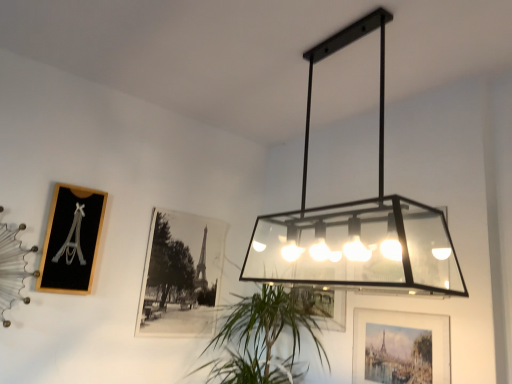
Where is `black wood picture frame at left, which appears as the 3th picture frame when viewed from the right`? This screenshot has width=512, height=384. black wood picture frame at left, which appears as the 3th picture frame when viewed from the right is located at coordinates (71, 239).

The image size is (512, 384). Describe the element at coordinates (71, 239) in the screenshot. I see `black wood picture frame at left, which appears as the 3th picture frame when viewed from the right` at that location.

Measure the distance between green leafy plant at center and camera.

green leafy plant at center is 2.23 meters away from camera.

The height and width of the screenshot is (384, 512). Identify the location of matte black rectangular light fixture at upper center. (355, 221).

Is black wood picture frame at left, which appears as the 1th picture frame when viewed from the left, inside or outside of matte glass picture frame at lower right, which ranks as the first picture frame in right-to-left order?

black wood picture frame at left, which appears as the 1th picture frame when viewed from the left, is located beyond the bounds of matte glass picture frame at lower right, which ranks as the first picture frame in right-to-left order.

In the scene shown: Between black wood picture frame at left, which appears as the 1th picture frame when viewed from the left, and matte glass picture frame at lower right, which ranks as the first picture frame in right-to-left order, which one has smaller size?

With smaller size is matte glass picture frame at lower right, which ranks as the first picture frame in right-to-left order.

Measure the distance between black wood picture frame at left, which appears as the 3th picture frame when viewed from the right, and matte glass picture frame at lower right, positioned as the third picture frame in left-to-right order.

black wood picture frame at left, which appears as the 3th picture frame when viewed from the right, and matte glass picture frame at lower right, positioned as the third picture frame in left-to-right order, are 4.89 feet apart from each other.

Is black wood picture frame at left, which appears as the 3th picture frame when viewed from the right, to the left of green leafy plant at center from the viewer's perspective?

Correct, you'll find black wood picture frame at left, which appears as the 3th picture frame when viewed from the right, to the left of green leafy plant at center.

From a real-world perspective, which object stands above the other?

black wood picture frame at left, which appears as the 3th picture frame when viewed from the right.

Looking at their sizes, would you say black wood picture frame at left, which appears as the 3th picture frame when viewed from the right, is wider or thinner than green leafy plant at center?

Considering their sizes, black wood picture frame at left, which appears as the 3th picture frame when viewed from the right, looks slimmer than green leafy plant at center.

Which object is further away from the camera, black wood picture frame at left, which appears as the 3th picture frame when viewed from the right, or green leafy plant at center?

black wood picture frame at left, which appears as the 3th picture frame when viewed from the right, is more distant.

Locate an element on the screen. The image size is (512, 384). the 2nd picture frame behind the matte black rectangular light fixture at upper center is located at coordinates (71, 239).

Who is bigger, black wood picture frame at left, which appears as the 1th picture frame when viewed from the left, or matte black rectangular light fixture at upper center?

matte black rectangular light fixture at upper center is bigger.

From a real-world perspective, is black wood picture frame at left, which appears as the 1th picture frame when viewed from the left, physically above matte black rectangular light fixture at upper center?

No, from a real-world perspective, black wood picture frame at left, which appears as the 1th picture frame when viewed from the left, is not on top of matte black rectangular light fixture at upper center.

Can matte black rectangular light fixture at upper center be found inside black wood picture frame at left, which appears as the 1th picture frame when viewed from the left?

No, matte black rectangular light fixture at upper center is not inside black wood picture frame at left, which appears as the 1th picture frame when viewed from the left.

Is matte glass picture frame at lower right, positioned as the third picture frame in left-to-right order, inside green leafy plant at center?

Definitely not — matte glass picture frame at lower right, positioned as the third picture frame in left-to-right order, is not inside green leafy plant at center.

Is green leafy plant at center turned away from matte glass picture frame at lower right, which ranks as the first picture frame in right-to-left order?

That's not correct — green leafy plant at center is not looking away from matte glass picture frame at lower right, which ranks as the first picture frame in right-to-left order.

From the picture: Are green leafy plant at center and matte glass picture frame at lower right, which ranks as the first picture frame in right-to-left order, located far from each other?

No, green leafy plant at center is not far away from matte glass picture frame at lower right, which ranks as the first picture frame in right-to-left order.

Does matte glass picture frame at lower right, which ranks as the first picture frame in right-to-left order, contain black wood picture frame at left, which appears as the 1th picture frame when viewed from the left?

No, matte glass picture frame at lower right, which ranks as the first picture frame in right-to-left order, does not contain black wood picture frame at left, which appears as the 1th picture frame when viewed from the left.

How much distance is there between matte glass picture frame at lower right, positioned as the third picture frame in left-to-right order, and black wood picture frame at left, which appears as the 3th picture frame when viewed from the right?

matte glass picture frame at lower right, positioned as the third picture frame in left-to-right order, and black wood picture frame at left, which appears as the 3th picture frame when viewed from the right, are 1.49 meters apart from each other.

Looking at this image, from a real-world perspective, is matte glass picture frame at lower right, which ranks as the first picture frame in right-to-left order, above or below black wood picture frame at left, which appears as the 3th picture frame when viewed from the right?

Clearly, from a real-world perspective, matte glass picture frame at lower right, which ranks as the first picture frame in right-to-left order, is below black wood picture frame at left, which appears as the 3th picture frame when viewed from the right.

Can you tell me how much matte glass picture frame at lower right, positioned as the third picture frame in left-to-right order, and black wood picture frame at left, which appears as the 3th picture frame when viewed from the right, differ in facing direction?

They differ by 89.9 degrees in their facing directions.

Consider the image. Is the position of green leafy plant at center less distant than that of black wood picture frame at left, which appears as the 3th picture frame when viewed from the right?

Yes, the depth of green leafy plant at center is less than that of black wood picture frame at left, which appears as the 3th picture frame when viewed from the right.

Is green leafy plant at center inside or outside of black wood picture frame at left, which appears as the 1th picture frame when viewed from the left?

green leafy plant at center is spatially situated outside black wood picture frame at left, which appears as the 1th picture frame when viewed from the left.

Is green leafy plant at center turned away from black wood picture frame at left, which appears as the 3th picture frame when viewed from the right?

No.

Is green leafy plant at center not near black wood picture frame at left, which appears as the 3th picture frame when viewed from the right?

green leafy plant at center is positioned a significant distance from black wood picture frame at left, which appears as the 3th picture frame when viewed from the right.

Is matte glass picture frame at lower right, which ranks as the first picture frame in right-to-left order, facing towards green leafy plant at center?

No, matte glass picture frame at lower right, which ranks as the first picture frame in right-to-left order, is not facing towards green leafy plant at center.

Which object is thinner, matte glass picture frame at lower right, positioned as the third picture frame in left-to-right order, or green leafy plant at center?

matte glass picture frame at lower right, positioned as the third picture frame in left-to-right order.

Which object is closer to the camera taking this photo, matte glass picture frame at lower right, which ranks as the first picture frame in right-to-left order, or green leafy plant at center?

matte glass picture frame at lower right, which ranks as the first picture frame in right-to-left order.

Locate an element on the screen. the 2nd picture frame above the matte glass picture frame at lower right, which ranks as the first picture frame in right-to-left order (from the image's perspective) is located at coordinates (71, 239).

You are a GUI agent. You are given a task and a screenshot of the screen. Output one action in this format:
    pyautogui.click(x=<x>, y=<y>)
    Task: Click on the 2nd picture frame located above the green leafy plant at center (from a real-world perspective)
    
    Given the screenshot: What is the action you would take?
    pyautogui.click(x=71, y=239)

Based on their spatial positions, is matte black rectangular light fixture at upper center or black matte photo frame at center, which is counted as the second picture frame, starting from the right, closer to matte glass picture frame at lower right, positioned as the third picture frame in left-to-right order?

matte black rectangular light fixture at upper center is positioned closer to the anchor matte glass picture frame at lower right, positioned as the third picture frame in left-to-right order.

Looking at the image, which one is located closer to black wood picture frame at left, which appears as the 1th picture frame when viewed from the left, matte glass picture frame at lower right, positioned as the third picture frame in left-to-right order, or matte black rectangular light fixture at upper center?

matte black rectangular light fixture at upper center.

From the image, which object appears to be nearer to black matte photo frame at center, the 2th picture frame when ordered from left to right, green leafy plant at center or matte black rectangular light fixture at upper center?

green leafy plant at center is positioned closer to the anchor black matte photo frame at center, the 2th picture frame when ordered from left to right.

Looking at the image, which one is located closer to matte glass picture frame at lower right, which ranks as the first picture frame in right-to-left order, black matte photo frame at center, which is counted as the second picture frame, starting from the right, or green leafy plant at center?

green leafy plant at center is positioned closer to the anchor matte glass picture frame at lower right, which ranks as the first picture frame in right-to-left order.

Based on their spatial positions, is green leafy plant at center or matte black rectangular light fixture at upper center further from matte glass picture frame at lower right, positioned as the third picture frame in left-to-right order?

Among the two, matte black rectangular light fixture at upper center is located further to matte glass picture frame at lower right, positioned as the third picture frame in left-to-right order.

Looking at the image, which one is located closer to green leafy plant at center, black matte photo frame at center, the 2th picture frame when ordered from left to right, or matte glass picture frame at lower right, positioned as the third picture frame in left-to-right order?

black matte photo frame at center, the 2th picture frame when ordered from left to right, is closer to green leafy plant at center.

From the image, which object appears to be nearer to black wood picture frame at left, which appears as the 1th picture frame when viewed from the left, matte glass picture frame at lower right, which ranks as the first picture frame in right-to-left order, or black matte photo frame at center, which is counted as the second picture frame, starting from the right?

Based on the image, black matte photo frame at center, which is counted as the second picture frame, starting from the right, appears to be nearer to black wood picture frame at left, which appears as the 1th picture frame when viewed from the left.

From the image, which object appears to be nearer to matte black rectangular light fixture at upper center, black matte photo frame at center, which is counted as the second picture frame, starting from the right, or matte glass picture frame at lower right, which ranks as the first picture frame in right-to-left order?

matte glass picture frame at lower right, which ranks as the first picture frame in right-to-left order, is positioned closer to the anchor matte black rectangular light fixture at upper center.

Image resolution: width=512 pixels, height=384 pixels. In order to click on picture frame located between black wood picture frame at left, which appears as the 3th picture frame when viewed from the right, and green leafy plant at center in the left-right direction in this screenshot , I will do `click(181, 275)`.

Where is `houseplant positioned between matte black rectangular light fixture at upper center and black matte photo frame at center, which is counted as the second picture frame, starting from the right, from near to far`? Image resolution: width=512 pixels, height=384 pixels. houseplant positioned between matte black rectangular light fixture at upper center and black matte photo frame at center, which is counted as the second picture frame, starting from the right, from near to far is located at coordinates (263, 339).

Where is `lamp between black wood picture frame at left, which appears as the 1th picture frame when viewed from the left, and matte glass picture frame at lower right, which ranks as the first picture frame in right-to-left order, in the horizontal direction`? lamp between black wood picture frame at left, which appears as the 1th picture frame when viewed from the left, and matte glass picture frame at lower right, which ranks as the first picture frame in right-to-left order, in the horizontal direction is located at coordinates (355, 221).

You are a GUI agent. You are given a task and a screenshot of the screen. Output one action in this format:
    pyautogui.click(x=<x>, y=<y>)
    Task: Click on the houseplant between black wood picture frame at left, which appears as the 1th picture frame when viewed from the left, and matte black rectangular light fixture at upper center
    The height and width of the screenshot is (384, 512).
    Given the screenshot: What is the action you would take?
    pyautogui.click(x=263, y=339)